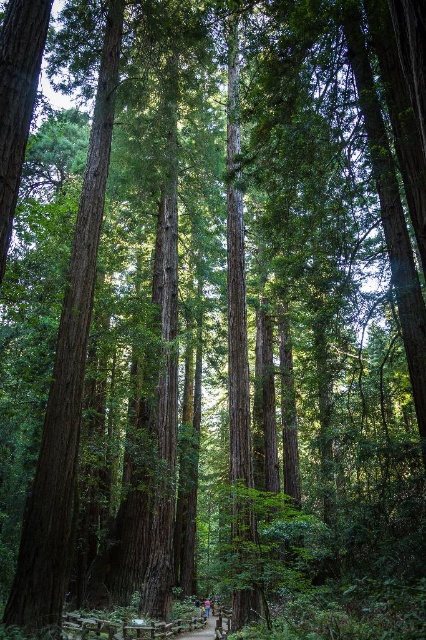
You are a hiker wearing blue denim jeans at center and standing on the brown wooden path at center. Can you feel the ground beneath your feet?

The brown wooden path at center is above blue denim jeans at center, so the hiker cannot feel the ground beneath their feet since they are on the wooden path.

You are a hiker wearing blue denim jeans at center and standing on the brown wooden path at center. You want to know if your jeans will get dirty if you step off the path. Based on the scene description, can you determine if the path is wider than your jeans?

The brown wooden path at center has a larger size compared to blue denim jeans at center, so stepping off the path might risk getting your jeans dirty since the path is wider than your jeans.

You are a hiker wearing blue denim jeans at center and standing on the brown wooden path at center. Can you walk sideways along the path without your jeans brushing the vegetation on either side?

The brown wooden path at center is wider than the blue denim jeans at center, so yes, you can walk sideways along the path without your jeans brushing the vegetation on either side.